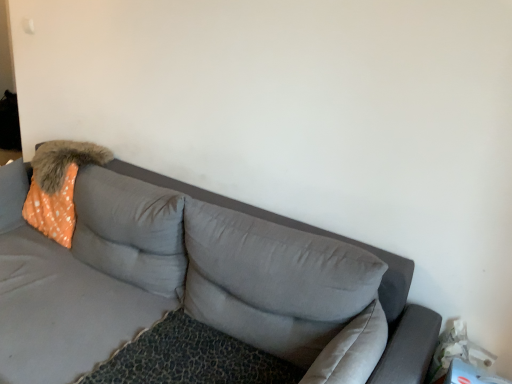
Question: In the image, is orange dotted fabric at left on the left side or the right side of gray fabric couch at center?

Choices:
 (A) left
 (B) right

Answer: (A)

Question: In the image, is orange dotted fabric at left positioned in front of or behind gray fabric couch at center?

Choices:
 (A) behind
 (B) front

Answer: (A)

Question: Estimate the real-world distances between objects in this image. Which object is closer to the gray fabric couch at center?

Choices:
 (A) orange dotted fabric at left
 (B) orange dotted fabric pillow at upper left, arranged as the first pillow when viewed from the left
 (C) gray fabric pillow at center, which is counted as the 2th pillow, starting from the left

Answer: (B)

Question: Estimate the real-world distances between objects in this image. Which object is farther from the orange dotted fabric at left?

Choices:
 (A) orange dotted fabric pillow at upper left, which is counted as the second pillow, starting from the right
 (B) gray fabric couch at center
 (C) gray fabric pillow at center, which is counted as the first pillow, starting from the right

Answer: (C)